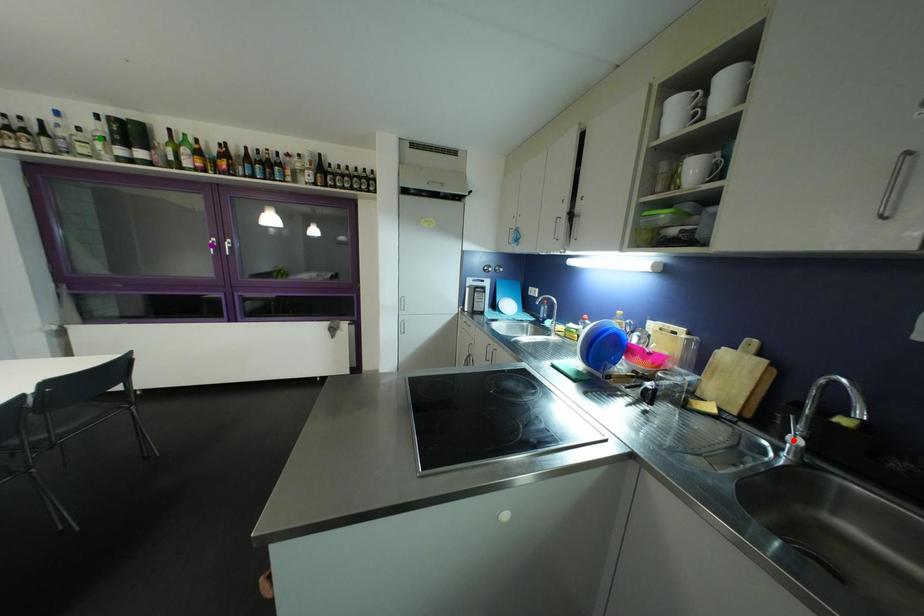
Order these from farthest to nearest:
A) purple point
B) green point
C) red point

purple point
green point
red point